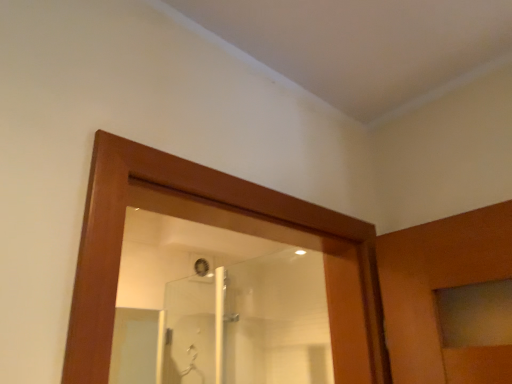
In order to face clear glass shower at center, should I rotate leftwards or rightwards?

Rotate your view left by about 3.110°.

Where is `clear glass shower at center`? This screenshot has width=512, height=384. clear glass shower at center is located at coordinates (216, 305).

Describe the element at coordinates (216, 305) in the screenshot. I see `clear glass shower at center` at that location.

Where is `clear glass shower at center`? The image size is (512, 384). clear glass shower at center is located at coordinates (216, 305).